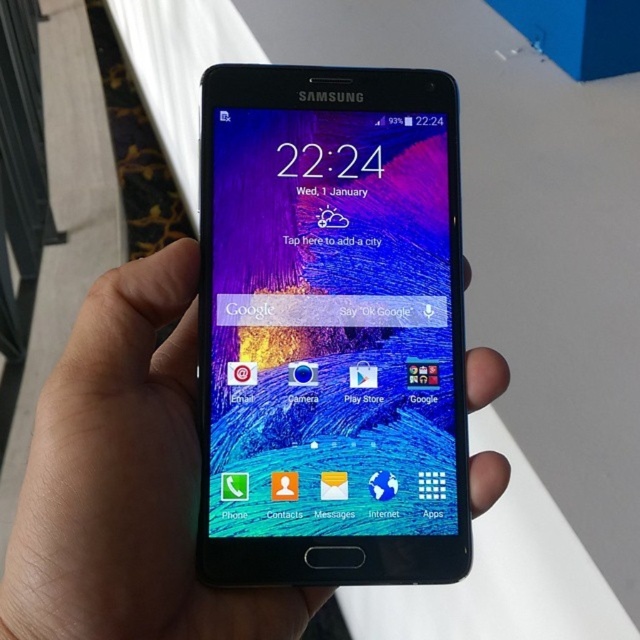
Is matte glass phone at center further to camera compared to black matte phone at center?

Yes.

Is point (230, 163) in front of point (301, 630)?

That is False.

Does point (380, 182) come behind point (172, 298)?

Yes, point (380, 182) is farther from viewer.

Image resolution: width=640 pixels, height=640 pixels. In order to click on matte glass phone at center in this screenshot , I will do `click(332, 324)`.